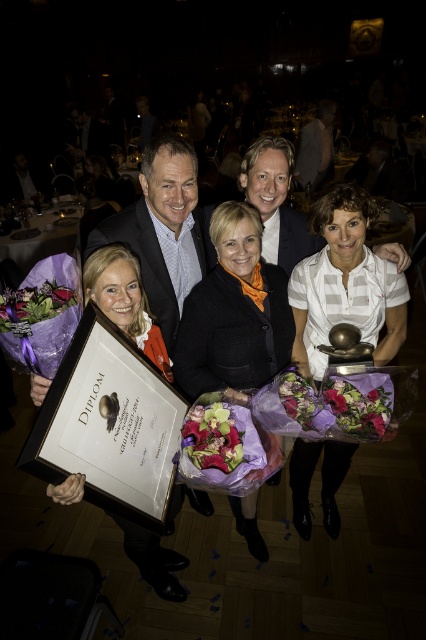
Question: Which point is farther from the camera taking this photo?

Choices:
 (A) [261, 369]
 (B) [363, 372]
 (C) [253, 172]

Answer: (C)

Question: Is matte black frame at center thinner than purple silk bouquet at lower right?

Choices:
 (A) no
 (B) yes

Answer: (A)

Question: Considering the real-world distances, which object is closest to the matte black frame at center?

Choices:
 (A) dark blue suit at center
 (B) purple floral bouquet at center

Answer: (B)

Question: Which object is positioned farthest from the purple silk bouquet at lower right?

Choices:
 (A) light brown suit at center
 (B) matte black frame at center
 (C) dark blue suit at center

Answer: (C)

Question: Can you confirm if matte black frame at center is bigger than vibrant purple bouquet at center?

Choices:
 (A) no
 (B) yes

Answer: (B)

Question: Considering the relative positions of white striped shirt at center and dark blue suit at center in the image provided, where is white striped shirt at center located with respect to dark blue suit at center?

Choices:
 (A) above
 (B) below

Answer: (B)